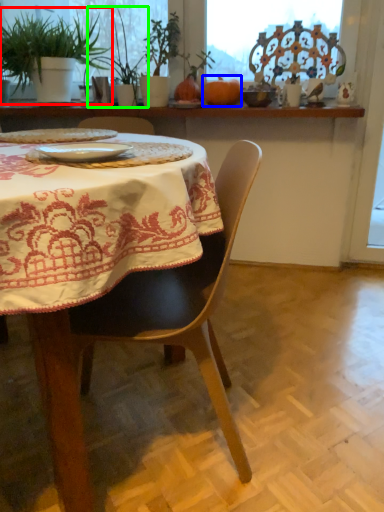
Question: Considering the real-world distances, which object is closest to houseplant (highlighted by a red box)? pumpkin (highlighted by a blue box) or plant (highlighted by a green box).

Choices:
 (A) pumpkin
 (B) plant

Answer: (B)